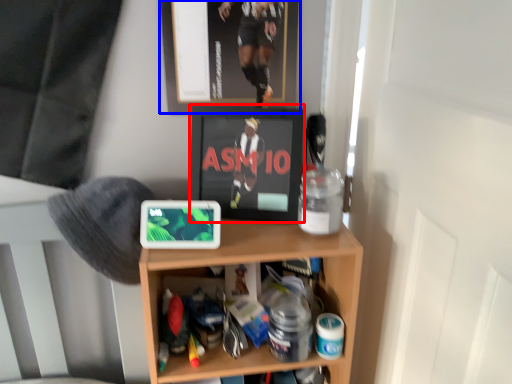
Question: Which object appears farthest to the camera in this image, wide (highlighted by a red box) or picture frame (highlighted by a blue box)?

Choices:
 (A) wide
 (B) picture frame

Answer: (A)